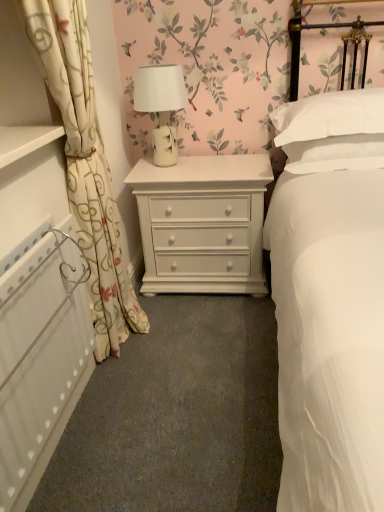
Question: Is white soft pillow at upper right far away from white textured radiator at left?

Choices:
 (A) no
 (B) yes

Answer: (B)

Question: Does white soft pillow at upper right have a larger size compared to white textured radiator at left?

Choices:
 (A) no
 (B) yes

Answer: (B)

Question: From a real-world perspective, is white soft pillow at upper right physically above white textured radiator at left?

Choices:
 (A) no
 (B) yes

Answer: (B)

Question: Is white soft pillow at upper right taller than white textured radiator at left?

Choices:
 (A) no
 (B) yes

Answer: (A)

Question: Could you tell me if white soft pillow at upper right is facing white textured radiator at left?

Choices:
 (A) yes
 (B) no

Answer: (B)

Question: In the image, is white textured radiator at left positioned in front of or behind white ceramic lamp at center?

Choices:
 (A) behind
 (B) front

Answer: (B)

Question: Looking at the image, does white textured radiator at left seem bigger or smaller compared to white ceramic lamp at center?

Choices:
 (A) big
 (B) small

Answer: (A)

Question: Considering the positions of white textured radiator at left and white ceramic lamp at center in the image, is white textured radiator at left taller or shorter than white ceramic lamp at center?

Choices:
 (A) short
 (B) tall

Answer: (B)

Question: Does point (56, 302) appear closer or farther from the camera than point (175, 157)?

Choices:
 (A) farther
 (B) closer

Answer: (B)

Question: Is white painted wood chest of drawers at center inside or outside of white textured radiator at left?

Choices:
 (A) outside
 (B) inside

Answer: (A)

Question: Does point (223, 245) appear closer or farther from the camera than point (77, 344)?

Choices:
 (A) farther
 (B) closer

Answer: (A)

Question: Considering the relative positions of white painted wood chest of drawers at center and white textured radiator at left in the image provided, is white painted wood chest of drawers at center to the left or to the right of white textured radiator at left?

Choices:
 (A) left
 (B) right

Answer: (B)

Question: From their relative heights in the image, would you say white painted wood chest of drawers at center is taller or shorter than white textured radiator at left?

Choices:
 (A) short
 (B) tall

Answer: (A)

Question: Choose the correct answer: Is white textured radiator at left inside white soft pillow at upper right or outside it?

Choices:
 (A) outside
 (B) inside

Answer: (A)

Question: Considering the relative positions of white textured radiator at left and white soft pillow at upper right in the image provided, is white textured radiator at left to the left or to the right of white soft pillow at upper right?

Choices:
 (A) left
 (B) right

Answer: (A)